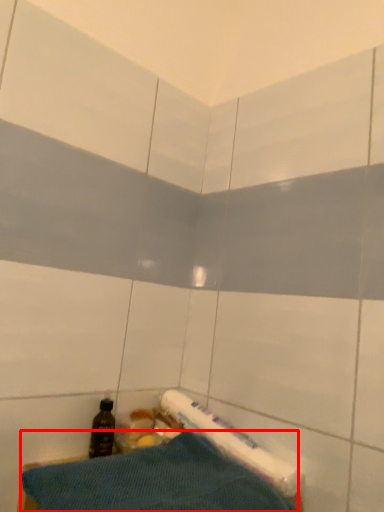
Question: Considering the relative positions of sheet (annotated by the red box) and bottle in the image provided, where is sheet (annotated by the red box) located with respect to the staircase?

Choices:
 (A) right
 (B) left

Answer: (A)